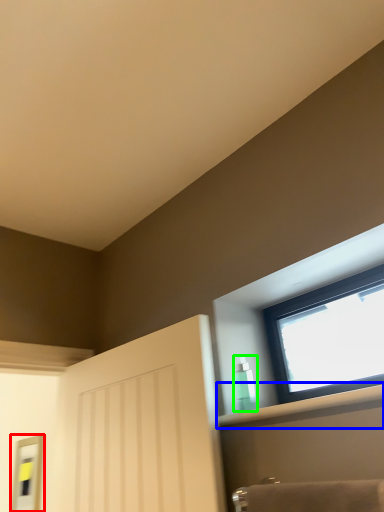
Question: Based on their relative distances, which object is nearer to mirror (highlighted by a red box)? Choose from shelf (highlighted by a blue box) and toiletry (highlighted by a green box).

Choices:
 (A) shelf
 (B) toiletry

Answer: (B)